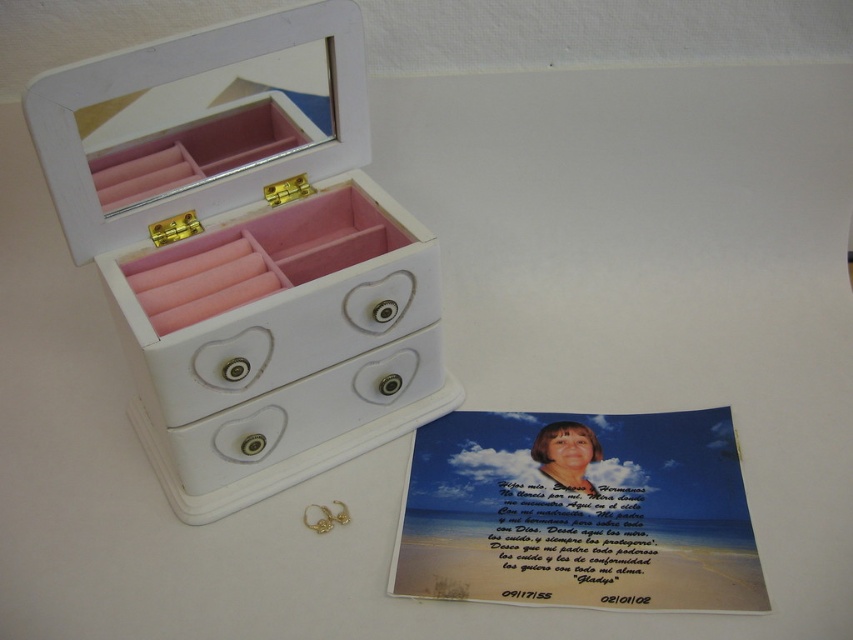
You are organizing a display and need to place a small figurine on the closest object to you between the white matte jewelry box at center and the white matte drawer at center. Which object should you choose?

The white matte jewelry box at center is closer to the viewer than the white matte drawer at center, so you should place the figurine on the white matte jewelry box at center.